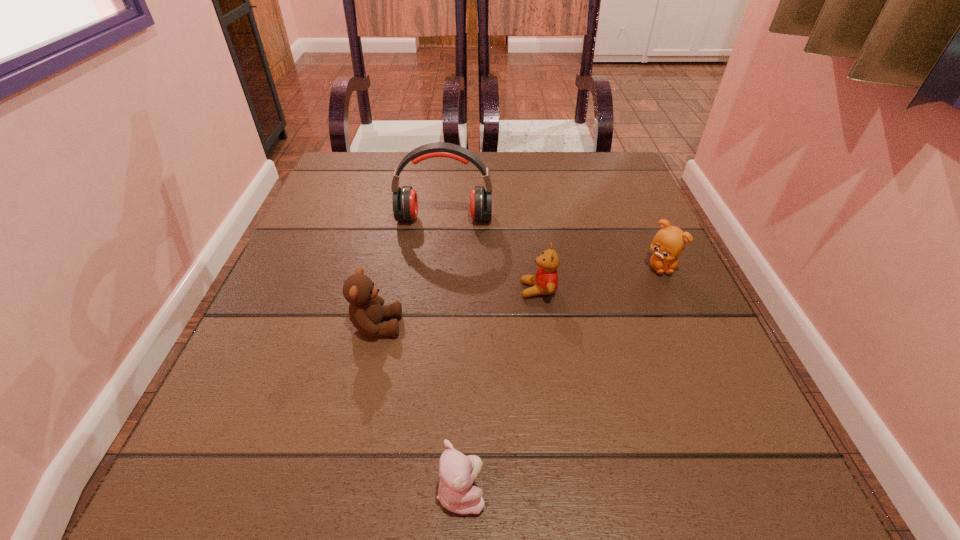
Where is `vacant space at the right edge`? vacant space at the right edge is located at coordinates (692, 409).

You are a GUI agent. You are given a task and a screenshot of the screen. Output one action in this format:
    pyautogui.click(x=<x>, y=<y>)
    Task: Click on the vacant space at the far left corner of the desktop
    
    Given the screenshot: What is the action you would take?
    pyautogui.click(x=365, y=158)

Identify the location of vacant space at the far right corner of the desktop. (622, 168).

You are a GUI agent. You are given a task and a screenshot of the screen. Output one action in this format:
    pyautogui.click(x=<x>, y=<y>)
    Task: Click on the empty space that is in between the farthest object and the fourth object from left to right
    This screenshot has width=960, height=540.
    Given the screenshot: What is the action you would take?
    pyautogui.click(x=492, y=254)

This screenshot has height=540, width=960. Identify the location of blank region between the rightmost object and the second object from right to left. (599, 279).

Where is `vacant region between the rightmost teddy bear and the tallest object`? This screenshot has height=540, width=960. vacant region between the rightmost teddy bear and the tallest object is located at coordinates (552, 242).

This screenshot has height=540, width=960. I want to click on free space between the second nearest object and the nearest teddy bear, so click(419, 409).

What are the coordinates of `free spot between the second teddy bear from right to left and the second teddy bear from left to right` in the screenshot? It's located at (500, 390).

What are the coordinates of `free spot between the leftmost teddy bear and the second teddy bear from right to left` in the screenshot? It's located at (457, 308).

The width and height of the screenshot is (960, 540). Identify the location of empty space that is in between the second object from right to left and the rightmost teddy bear. (599, 279).